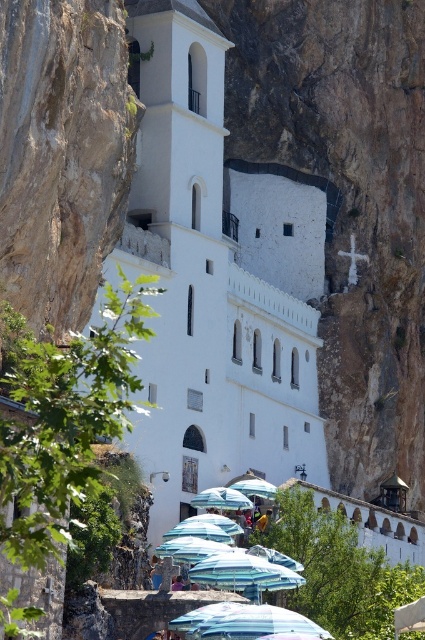
Between white smooth stone church at center and blue fabric umbrella at lower center, which one has more height?

Standing taller between the two is white smooth stone church at center.

Identify the location of white smooth stone church at center. This screenshot has height=640, width=425. (218, 276).